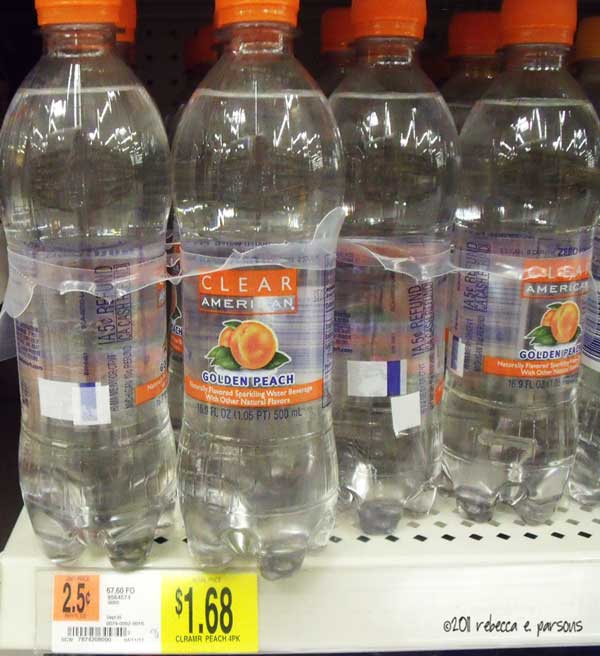
Locate an element on the screen. shelf is located at coordinates (333, 604), (178, 546), (18, 623).